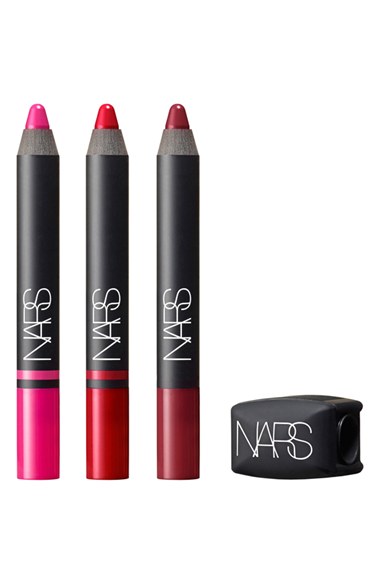
Where is `pencil sharpener`? pencil sharpener is located at coordinates (306, 445).